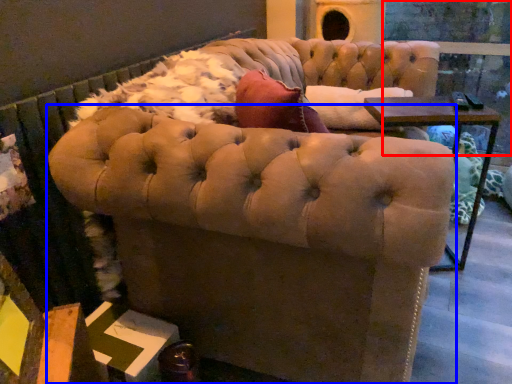
Question: Which object appears farthest to the camera in this image, glass door (highlighted by a red box) or chair (highlighted by a blue box)?

Choices:
 (A) glass door
 (B) chair

Answer: (A)